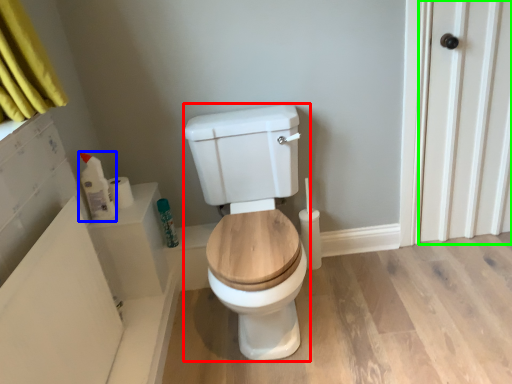
Question: Based on their relative distances, which object is nearer to porcelain (highlighted by a red box)? Choose from toiletry (highlighted by a blue box) and screen door (highlighted by a green box).

Choices:
 (A) toiletry
 (B) screen door

Answer: (A)